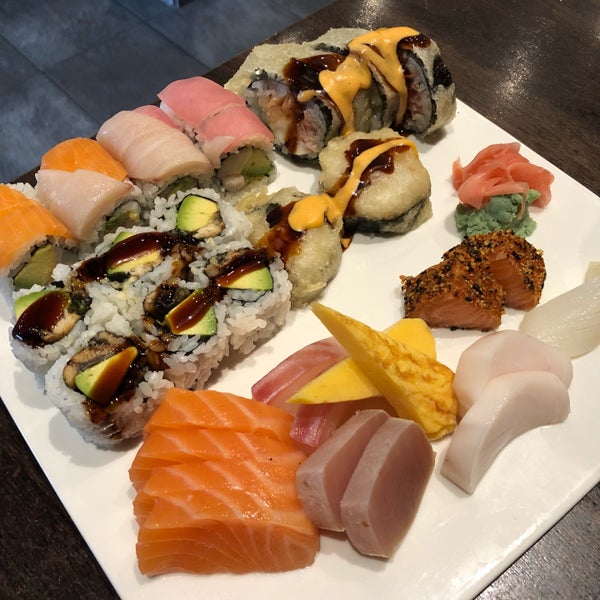
What are the coordinates of `empty space on table top to the right of the platter` in the screenshot? It's located at (548, 90).